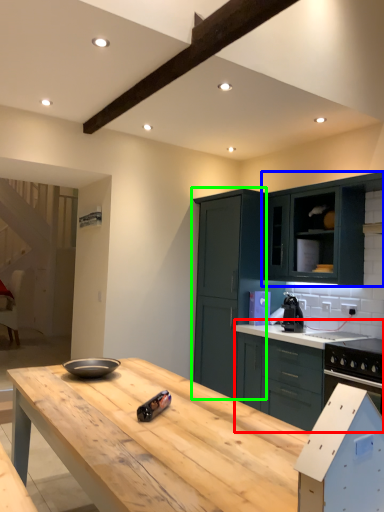
Question: Which object is positioned farthest from cabinetry (highlighted by a red box)? Select from cabinetry (highlighted by a blue box) and cabinetry (highlighted by a green box).

Choices:
 (A) cabinetry
 (B) cabinetry

Answer: (A)